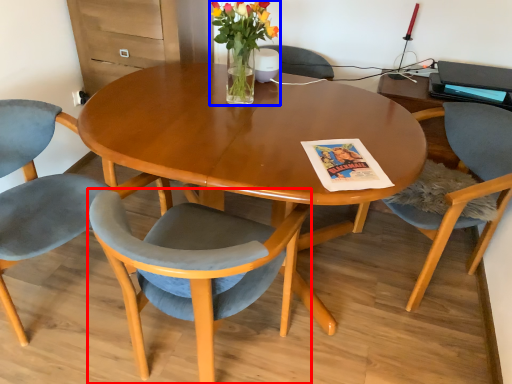
Question: Which of the following is the farthest to the observer, chair (highlighted by a red box) or floral arrangement (highlighted by a blue box)?

Choices:
 (A) chair
 (B) floral arrangement

Answer: (B)